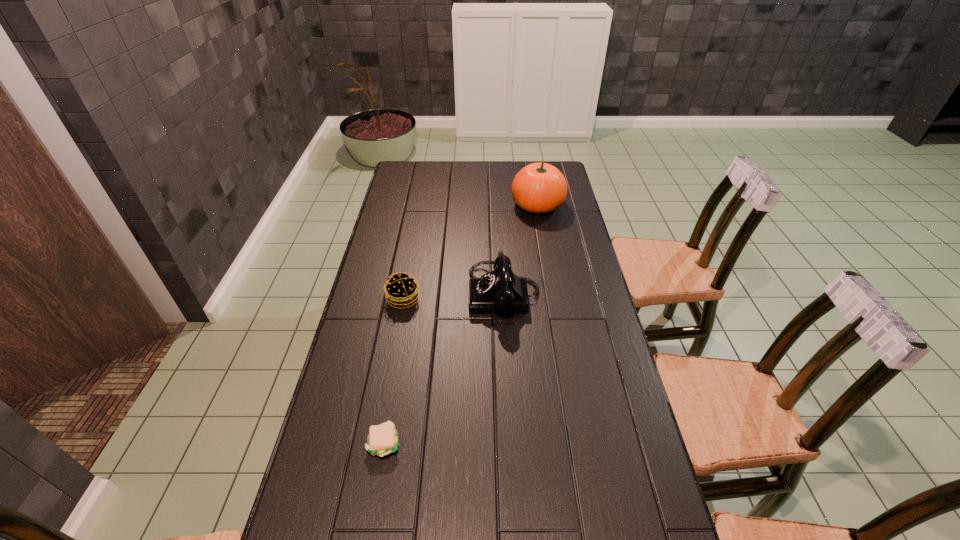
Locate an element on the screen. vacant space located 0.260m on the dial of the telephone is located at coordinates (390, 293).

Identify the location of vacant region located on the right of the farther patty. The height and width of the screenshot is (540, 960). (515, 299).

This screenshot has width=960, height=540. I want to click on free point located 0.110m on the right of the shortest object, so [x=446, y=443].

Where is `object situated at the right edge`? Image resolution: width=960 pixels, height=540 pixels. object situated at the right edge is located at coordinates (538, 188).

Where is `free spot at the far edge of the desktop`? free spot at the far edge of the desktop is located at coordinates (493, 163).

Identify the location of blank space at the left edge of the desktop. The height and width of the screenshot is (540, 960). (355, 447).

Find the location of a particular element. vacant region at the right edge of the desktop is located at coordinates (572, 291).

Where is `vacant space at the far right corner of the desktop`? vacant space at the far right corner of the desktop is located at coordinates (566, 177).

Identify the location of free space between the farthest object and the nearer patty. The height and width of the screenshot is (540, 960). (461, 324).

Locate an element on the screen. The width and height of the screenshot is (960, 540). free space between the third shortest object and the pumpkin is located at coordinates (520, 249).